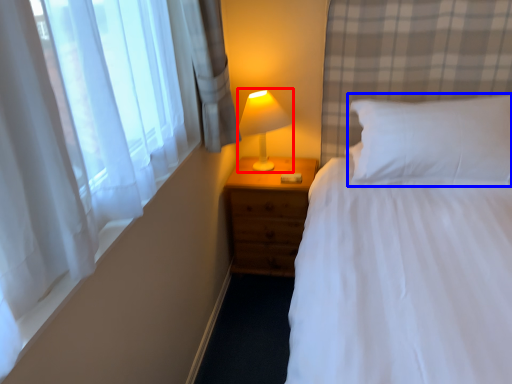
Question: Which object appears farthest to the camera in this image, lamp (highlighted by a red box) or pillow (highlighted by a blue box)?

Choices:
 (A) lamp
 (B) pillow

Answer: (A)